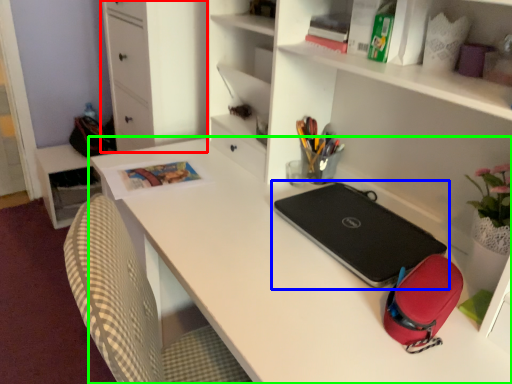
Question: Which object is the farthest from file cabinet (highlighted by a red box)? Choose among these: laptop (highlighted by a blue box) or desk (highlighted by a green box).

Choices:
 (A) laptop
 (B) desk

Answer: (A)